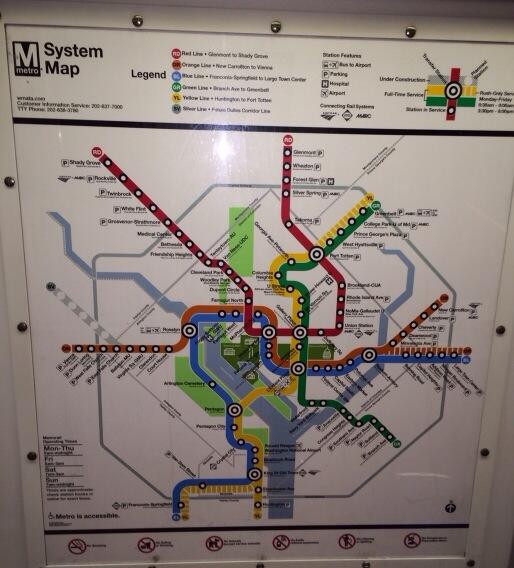
Find the location of a particular element. The width and height of the screenshot is (514, 568). wall is located at coordinates (9, 509).